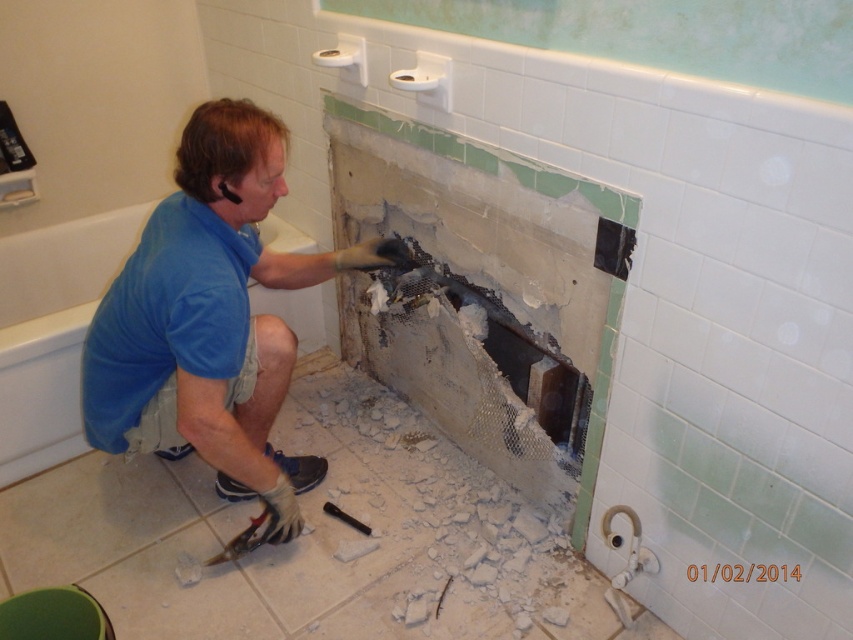
Where is the blue fabric shirt at center located in the image?

The blue fabric shirt at center is located at point (212,317) in the image.